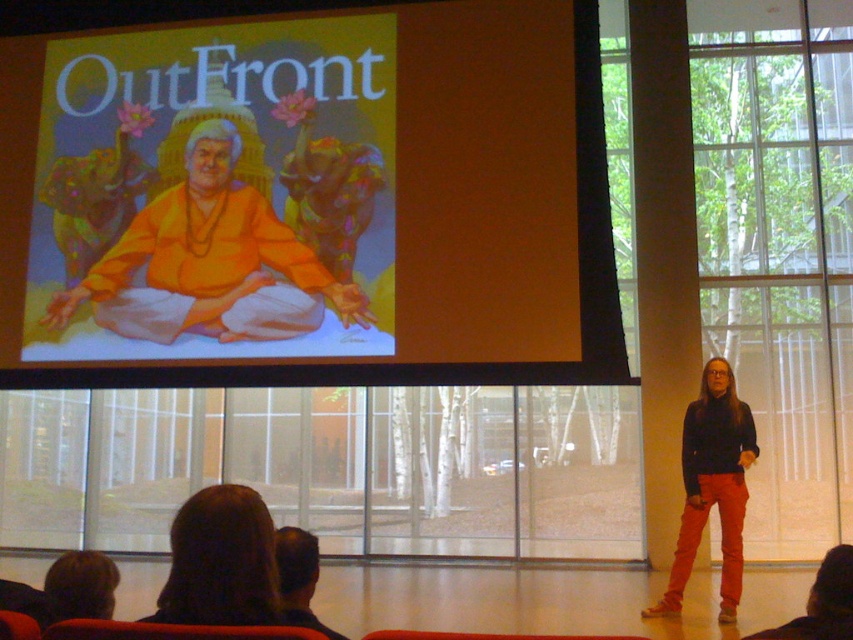
Looking at this image, does matte black sweater at center appear on the left side of dark brown hair at lower left?

In fact, matte black sweater at center is to the right of dark brown hair at lower left.

In the scene shown: Which of these two, matte black sweater at center or dark brown hair at lower left, stands taller?

matte black sweater at center is taller.

What do you see at coordinates (712, 484) in the screenshot?
I see `matte black sweater at center` at bounding box center [712, 484].

The width and height of the screenshot is (853, 640). What are the coordinates of `matte black sweater at center` in the screenshot? It's located at (712, 484).

The width and height of the screenshot is (853, 640). Find the location of `matte orange poster at center`. matte orange poster at center is located at coordinates (309, 202).

Does matte orange poster at center have a lesser width compared to matte orange fabric at center?

In fact, matte orange poster at center might be wider than matte orange fabric at center.

Does point (352, 65) come farther from viewer compared to point (242, 305)?

Yes, point (352, 65) is farther from viewer.

Find the location of a particular element. The height and width of the screenshot is (640, 853). matte orange poster at center is located at coordinates (309, 202).

Is matte orange poster at center behind matte black sweater at center?

Yes, matte orange poster at center is further from the viewer.

Locate an element on the screen. The width and height of the screenshot is (853, 640). matte orange poster at center is located at coordinates (309, 202).